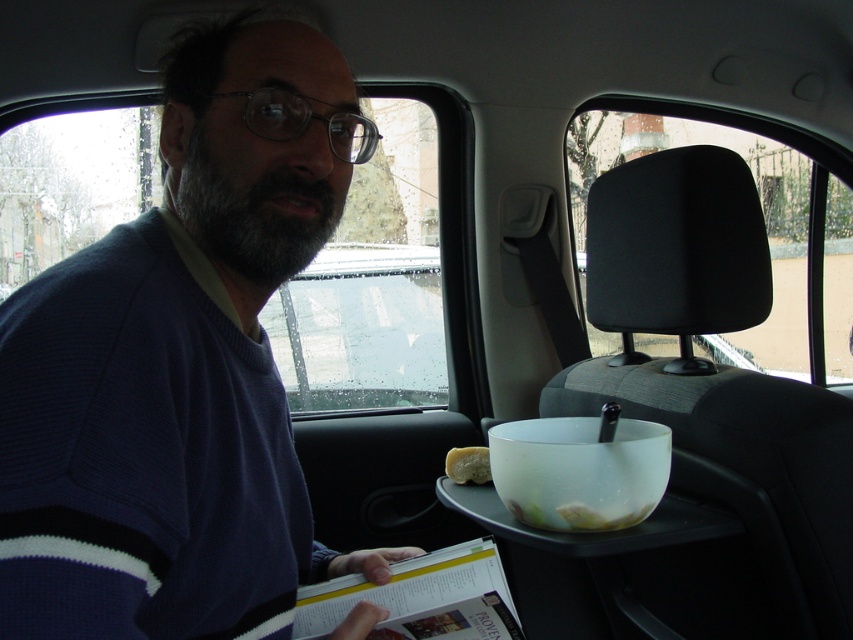
Question: Which of the following is the farthest from the observer?

Choices:
 (A) white matte bread at center
 (B) dark blue sweater at left

Answer: (A)

Question: Is dark blue sweater at left positioned at the back of white matte bread at center?

Choices:
 (A) no
 (B) yes

Answer: (A)

Question: Which object is closer to the camera taking this photo?

Choices:
 (A) white matte bread at center
 (B) dark blue sweater at left

Answer: (B)

Question: Can you confirm if dark blue sweater at left is thinner than white matte bread at center?

Choices:
 (A) no
 (B) yes

Answer: (A)

Question: Is dark blue sweater at left closer to camera compared to white matte bread at center?

Choices:
 (A) yes
 (B) no

Answer: (A)